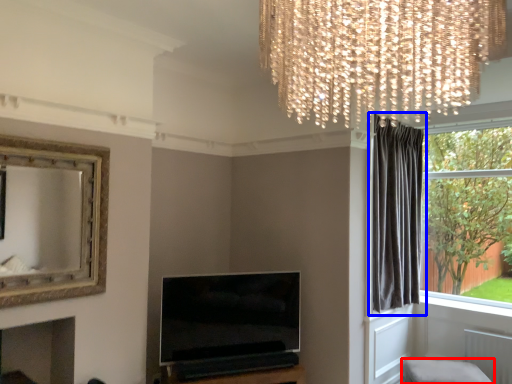
Question: Among these objects, which one is nearest to the camera, furniture (highlighted by a red box) or curtain (highlighted by a blue box)?

Choices:
 (A) furniture
 (B) curtain

Answer: (A)